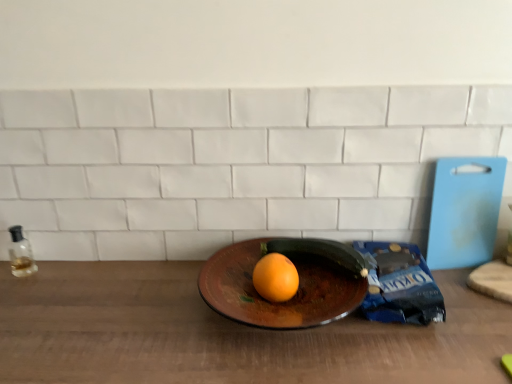
This screenshot has height=384, width=512. What are the coordinates of `shiny brown plate at center` in the screenshot? It's located at (280, 302).

Does point (24, 274) come closer to viewer compared to point (277, 293)?

No, (24, 274) is behind (277, 293).

Looking at this image, is transparent glass bottle at left positioned in front of orange matte at center?

No, transparent glass bottle at left is further to the viewer.

In terms of size, does transparent glass bottle at left appear bigger or smaller than orange matte at center?

Considering their sizes, transparent glass bottle at left takes up less space than orange matte at center.

Can you confirm if transparent glass bottle at left is taller than orange matte at center?

Yes, transparent glass bottle at left is taller than orange matte at center.

Which object is positioned more to the right, orange matte at center or green matte zucchini at center?

green matte zucchini at center.

In the scene shown: How different are the orientations of orange matte at center and green matte zucchini at center in degrees?

The facing directions of orange matte at center and green matte zucchini at center are 0.000869 degrees apart.

From their relative heights in the image, would you say orange matte at center is taller or shorter than green matte zucchini at center?

In the image, orange matte at center appears to be taller than green matte zucchini at center.

Considering the sizes of objects orange matte at center and green matte zucchini at center in the image provided, who is bigger, orange matte at center or green matte zucchini at center?

green matte zucchini at center is bigger.

You are a GUI agent. You are given a task and a screenshot of the screen. Output one action in this format:
    pyautogui.click(x=<x>, y=<y>)
    Task: Click on the banana positioned vertically above the orange matte at center (from a real-world perspective)
    This screenshot has width=512, height=384.
    Given the screenshot: What is the action you would take?
    pyautogui.click(x=320, y=251)

From a real-world perspective, is green matte zucchini at center physically located above or below orange matte at center?

From a real-world perspective, green matte zucchini at center is physically above orange matte at center.

Does point (352, 271) come closer to viewer compared to point (272, 287)?

No, (352, 271) is behind (272, 287).

Is green matte zucchini at center to the left or to the right of transparent glass bottle at left in the image?

Clearly, green matte zucchini at center is on the right of transparent glass bottle at left in the image.

Would you consider green matte zucchini at center to be distant from transparent glass bottle at left?

No.

From the image's perspective, is green matte zucchini at center located above or below transparent glass bottle at left?

Based on their image positions, green matte zucchini at center is located above transparent glass bottle at left.

Which is nearer, (362,275) or (236,263)?

Point (362,275) is positioned closer to the camera compared to point (236,263).

Would you consider green matte zucchini at center to be distant from shiny brown plate at center?

That's not correct — green matte zucchini at center is a little close to shiny brown plate at center.

In the scene shown: From a real-world perspective, is green matte zucchini at center located beneath shiny brown plate at center?

Actually, green matte zucchini at center is physically above shiny brown plate at center in the real world.

What's the angular difference between green matte zucchini at center and shiny brown plate at center's facing directions?

0.000217 degrees.

Is shiny brown plate at center oriented away from green matte zucchini at center?

shiny brown plate at center is not turned away from green matte zucchini at center.

Who is shorter, shiny brown plate at center or green matte zucchini at center?

green matte zucchini at center is shorter.

From a real-world perspective, which is physically below, shiny brown plate at center or green matte zucchini at center?

In real-world perspective, shiny brown plate at center is lower.

Who is shorter, orange matte at center or shiny brown plate at center?

orange matte at center is shorter.

Which of these two, orange matte at center or shiny brown plate at center, is thinner?

orange matte at center.

From the image's perspective, is orange matte at center over shiny brown plate at center?

Correct, orange matte at center appears higher than shiny brown plate at center in the image.

Does orange matte at center have a smaller size compared to shiny brown plate at center?

Yes.

You are a GUI agent. You are given a task and a screenshot of the screen. Output one action in this format:
    pyautogui.click(x=<x>, y=<y>)
    Task: Click on the grapefruit in front of the transparent glass bottle at left
    The height and width of the screenshot is (384, 512).
    Given the screenshot: What is the action you would take?
    pyautogui.click(x=275, y=278)

This screenshot has height=384, width=512. What are the coordinates of `grapefruit on the left of green matte zucchini at center` in the screenshot? It's located at (275, 278).

Looking at the image, which one is located closer to transparent glass bottle at left, shiny brown plate at center or orange matte at center?

The object closer to transparent glass bottle at left is shiny brown plate at center.

Which object lies further to the anchor point green matte zucchini at center, shiny brown plate at center or orange matte at center?

orange matte at center is positioned further to the anchor green matte zucchini at center.

Which object lies further to the anchor point transparent glass bottle at left, orange matte at center or green matte zucchini at center?

green matte zucchini at center lies further to transparent glass bottle at left than the other object.

Looking at the image, which one is located further to transparent glass bottle at left, green matte zucchini at center or shiny brown plate at center?

green matte zucchini at center lies further to transparent glass bottle at left than the other object.

Looking at the image, which one is located further to green matte zucchini at center, shiny brown plate at center or transparent glass bottle at left?

transparent glass bottle at left is positioned further to the anchor green matte zucchini at center.

When comparing their distances from orange matte at center, does green matte zucchini at center or shiny brown plate at center seem further?

Based on the image, green matte zucchini at center appears to be further to orange matte at center.

Looking at the image, which one is located further to transparent glass bottle at left, green matte zucchini at center or orange matte at center?

green matte zucchini at center is positioned further to the anchor transparent glass bottle at left.

When comparing their distances from green matte zucchini at center, does transparent glass bottle at left or shiny brown plate at center seem further?

Based on the image, transparent glass bottle at left appears to be further to green matte zucchini at center.

Find the location of a particular element. The image size is (512, 384). grapefruit between shiny brown plate at center and green matte zucchini at center in the front-back direction is located at coordinates (275, 278).

At what (x,y) coordinates should I click in order to perform the action: click on grapefruit situated between transparent glass bottle at left and shiny brown plate at center from left to right. Please return your answer as a coordinate pair (x, y). This screenshot has width=512, height=384. Looking at the image, I should click on (275, 278).

Find the location of a particular element. Image resolution: width=512 pixels, height=384 pixels. grapefruit between transparent glass bottle at left and green matte zucchini at center is located at coordinates (275, 278).

Find the location of a particular element. The height and width of the screenshot is (384, 512). plate located between transparent glass bottle at left and green matte zucchini at center in the left-right direction is located at coordinates (280, 302).